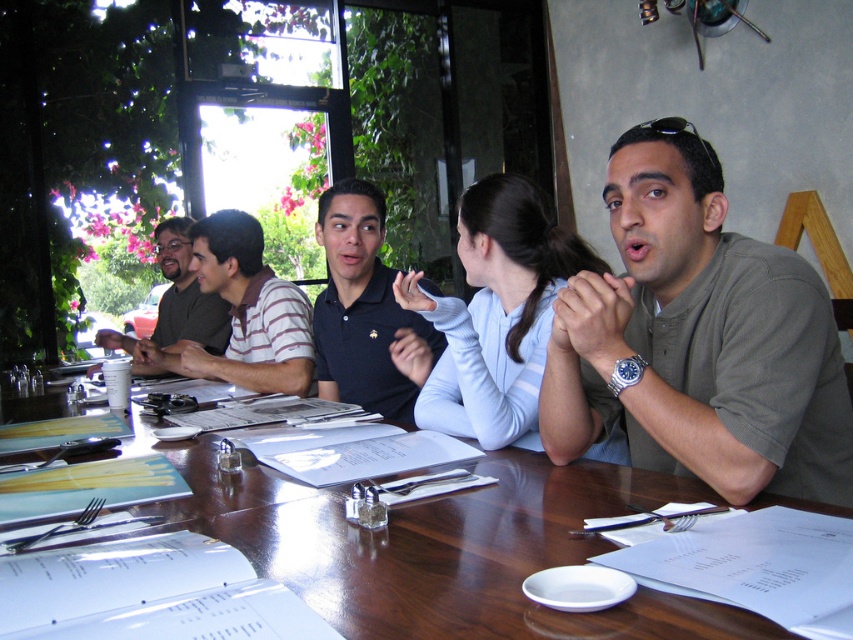
Question: Which point is closer to the camera?

Choices:
 (A) (711, 184)
 (B) (218, 216)
 (C) (344, 186)
 (D) (502, 264)

Answer: (A)

Question: Is green matte shirt at center above striped cotton shirt at center?

Choices:
 (A) no
 (B) yes

Answer: (A)

Question: From the image, what is the correct spatial relationship of glossy wood table at center in relation to light blue sweater at center?

Choices:
 (A) below
 (B) above

Answer: (A)

Question: Which point appears farthest from the camera in this image?

Choices:
 (A) (189, 280)
 (B) (453, 358)
 (C) (401, 362)

Answer: (A)

Question: Which point is farther to the camera?

Choices:
 (A) (225, 360)
 (B) (172, 292)
 (C) (142, 419)
 (D) (819, 483)

Answer: (B)

Question: Does glossy wood table at center have a smaller size compared to matte green shirt at left?

Choices:
 (A) no
 (B) yes

Answer: (B)